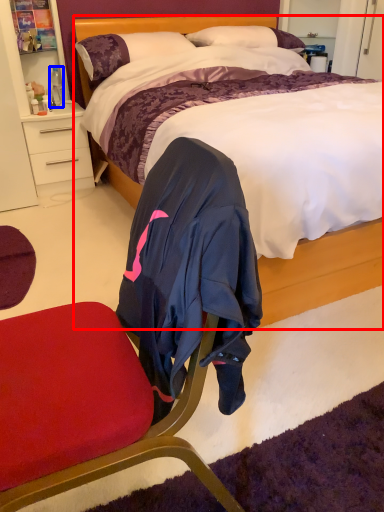
Question: Which object appears farthest to the camera in this image, bed (highlighted by a red box) or bottle (highlighted by a blue box)?

Choices:
 (A) bed
 (B) bottle

Answer: (B)